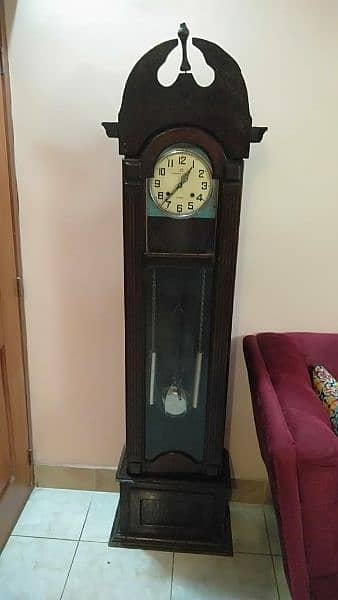
The height and width of the screenshot is (600, 338). What are the coordinates of `cushion` in the screenshot? It's located at (325, 384).